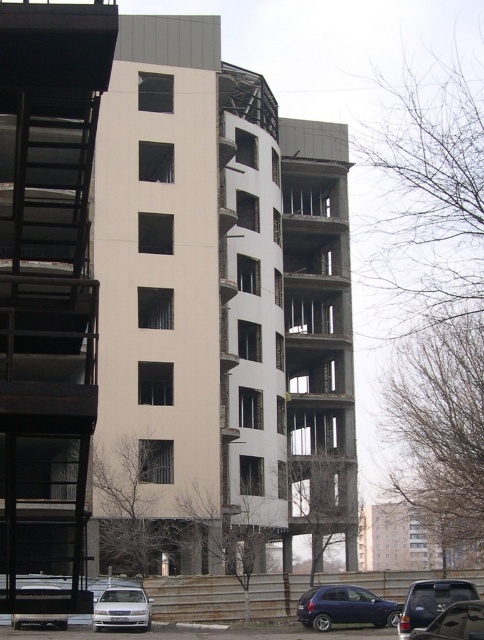
You are a delivery drone with a GPS coordinate system where the bottom left corner of the image is the origin point. You need to deliver a package to the black metal fire escape at left. What are the coordinates you should target?

The coordinates for the black metal fire escape at left are at point (47, 289).

You are a delivery drone operator. Your drone needs to land on a platform near the black metal fire escape at left. According to the coordinates provided, where should the drone aim to land?

The black metal fire escape at left is located at point (47,289), so the drone should aim for that coordinate to land near it.

You are a delivery driver approaching the building in the image. You need to park your metallic silver van at lower right near the black metal fire escape at left. Can you park your van in such a way that it doesn

The black metal fire escape at left is to the left of the metallic silver van at lower right, meaning the fire escape is positioned closer to the left side of the building. Since the van is at the lower right, parking it near the fire escape would require moving it to the left side of the building where the fire escape is located. However, the van is already at the lower right, so its current position is farther from the fire escape. To park near the fire escape, you would need to reposition the van to the